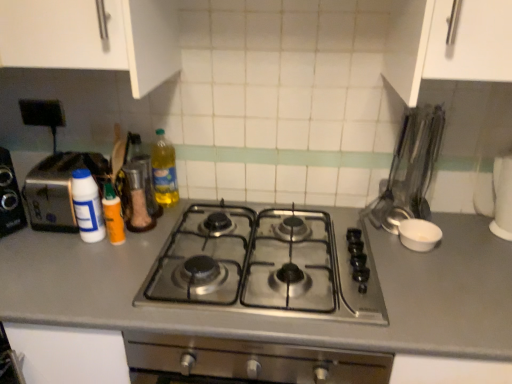
Identify the location of vacant space to the right of metallic silver utensils at right, acting as the second appliance starting from the bottom. (456, 226).